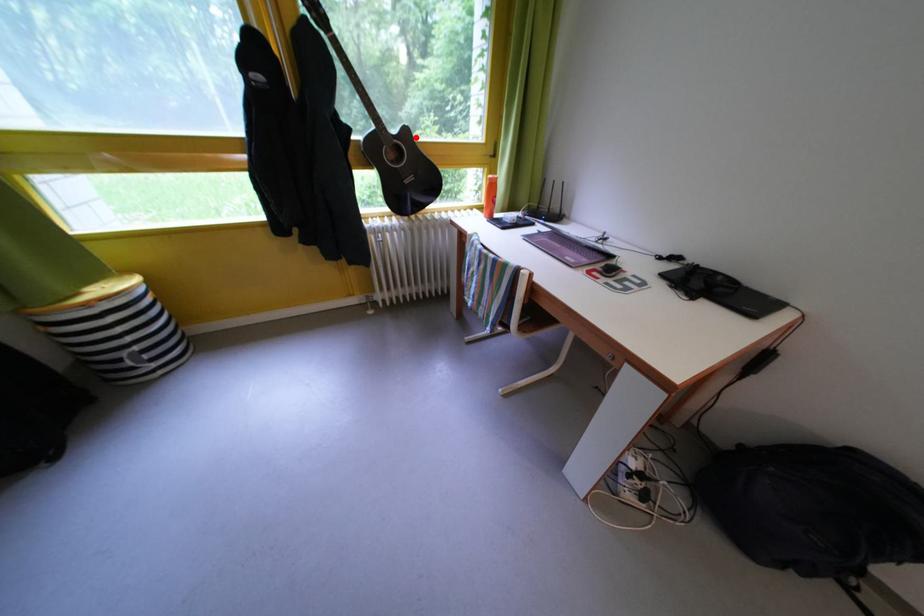
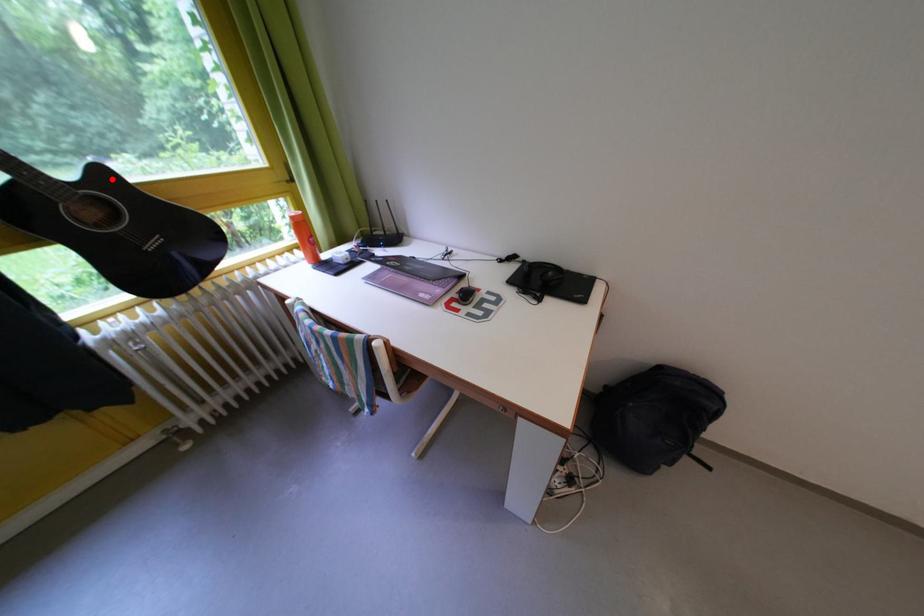
I am providing you with two images of the same scene from different viewpoints. A red point is marked on the first image and another point is marked on the second image. Do the highlighted points in image1 and image2 indicate the same real-world spot?

Yes